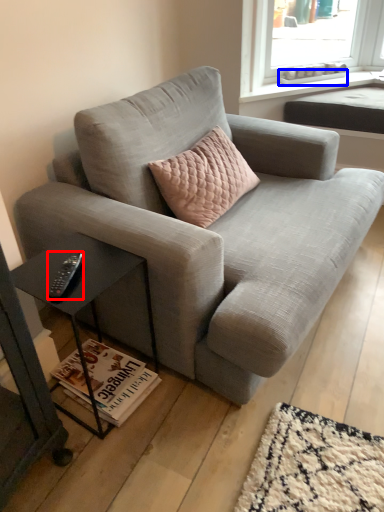
Question: Which point is further to the camera, remote (highlighted by a red box) or window sill (highlighted by a blue box)?

Choices:
 (A) remote
 (B) window sill

Answer: (B)